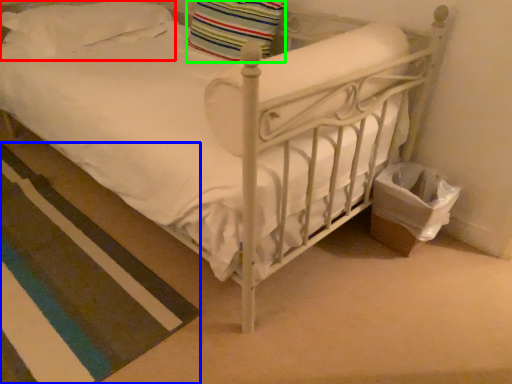
Question: Which object is positioned closest to pillow (highlighted by a red box)? Select from strip (highlighted by a blue box) and pillow (highlighted by a green box).

Choices:
 (A) strip
 (B) pillow

Answer: (B)